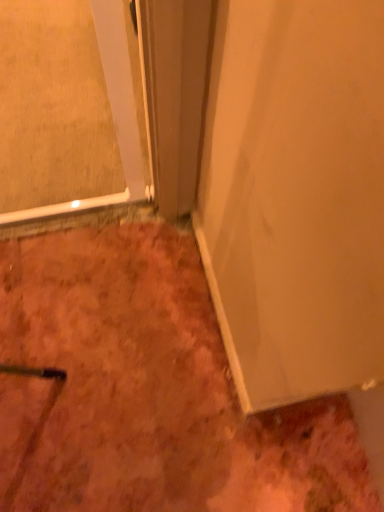
Question: Are clear glass door at upper left and white matte door at center located far from each other?

Choices:
 (A) no
 (B) yes

Answer: (A)

Question: Is clear glass door at upper left at the right side of white matte door at center?

Choices:
 (A) no
 (B) yes

Answer: (A)

Question: From the image's perspective, would you say clear glass door at upper left is shown under white matte door at center?

Choices:
 (A) yes
 (B) no

Answer: (B)

Question: Is clear glass door at upper left oriented towards white matte door at center?

Choices:
 (A) no
 (B) yes

Answer: (A)

Question: From a real-world perspective, is clear glass door at upper left physically above white matte door at center?

Choices:
 (A) no
 (B) yes

Answer: (A)

Question: Considering the positions of point (16, 426) and point (276, 218), is point (16, 426) closer or farther from the camera than point (276, 218)?

Choices:
 (A) closer
 (B) farther

Answer: (B)

Question: Choose the correct answer: Is dull orange carpet at lower left inside white matte door at center or outside it?

Choices:
 (A) inside
 (B) outside

Answer: (B)

Question: Considering the positions of dull orange carpet at lower left and white matte door at center in the image, is dull orange carpet at lower left taller or shorter than white matte door at center?

Choices:
 (A) short
 (B) tall

Answer: (A)

Question: Is dull orange carpet at lower left in front of or behind white matte door at center in the image?

Choices:
 (A) front
 (B) behind

Answer: (B)

Question: From the image's perspective, is white matte door at center positioned above or below dull orange carpet at lower left?

Choices:
 (A) above
 (B) below

Answer: (A)

Question: Looking at the image, does white matte door at center seem bigger or smaller compared to dull orange carpet at lower left?

Choices:
 (A) small
 (B) big

Answer: (A)

Question: Would you say white matte door at center is inside or outside dull orange carpet at lower left?

Choices:
 (A) inside
 (B) outside

Answer: (B)

Question: Does point (297, 94) appear closer or farther from the camera than point (230, 471)?

Choices:
 (A) closer
 (B) farther

Answer: (A)

Question: Would you say clear glass door at upper left is inside or outside white matte door at center?

Choices:
 (A) outside
 (B) inside

Answer: (A)

Question: From their relative heights in the image, would you say clear glass door at upper left is taller or shorter than white matte door at center?

Choices:
 (A) tall
 (B) short

Answer: (B)